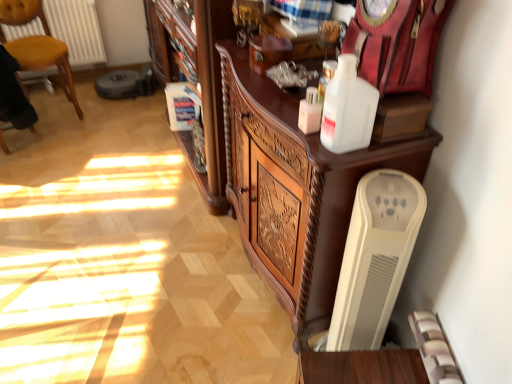
Question: Is yellow upholstered chair at left shorter than velvet black armchair at left?

Choices:
 (A) no
 (B) yes

Answer: (A)

Question: Is the surface of yellow upholstered chair at left in direct contact with velvet black armchair at left?

Choices:
 (A) yes
 (B) no

Answer: (B)

Question: Can you confirm if yellow upholstered chair at left is bigger than velvet black armchair at left?

Choices:
 (A) yes
 (B) no

Answer: (A)

Question: From a real-world perspective, is yellow upholstered chair at left under velvet black armchair at left?

Choices:
 (A) no
 (B) yes

Answer: (B)

Question: From the image's perspective, would you say yellow upholstered chair at left is shown under velvet black armchair at left?

Choices:
 (A) no
 (B) yes

Answer: (A)

Question: From a real-world perspective, is yellow upholstered chair at left located higher than velvet black armchair at left?

Choices:
 (A) no
 (B) yes

Answer: (A)

Question: Can you confirm if white glossy bottle at upper center, the 2th bottle in the right-to-left sequence, is positioned to the left of white plastic heater at lower right?

Choices:
 (A) no
 (B) yes

Answer: (B)

Question: From the image's perspective, is white glossy bottle at upper center, the 2th bottle in the right-to-left sequence, above white plastic heater at lower right?

Choices:
 (A) no
 (B) yes

Answer: (B)

Question: Is the position of white glossy bottle at upper center, arranged as the 1th bottle when viewed from the left, more distant than that of white plastic heater at lower right?

Choices:
 (A) yes
 (B) no

Answer: (A)

Question: Would you consider white glossy bottle at upper center, arranged as the 1th bottle when viewed from the left, to be distant from white plastic heater at lower right?

Choices:
 (A) no
 (B) yes

Answer: (A)

Question: Does white glossy bottle at upper center, arranged as the 1th bottle when viewed from the left, have a greater height compared to white plastic heater at lower right?

Choices:
 (A) yes
 (B) no

Answer: (B)

Question: Is white glossy bottle at upper center, the 2th bottle in the right-to-left sequence, outside white plastic heater at lower right?

Choices:
 (A) no
 (B) yes

Answer: (B)

Question: Is velvet black armchair at left outside of white plastic bottle at upper center, which appears as the second bottle when viewed from the left?

Choices:
 (A) yes
 (B) no

Answer: (A)